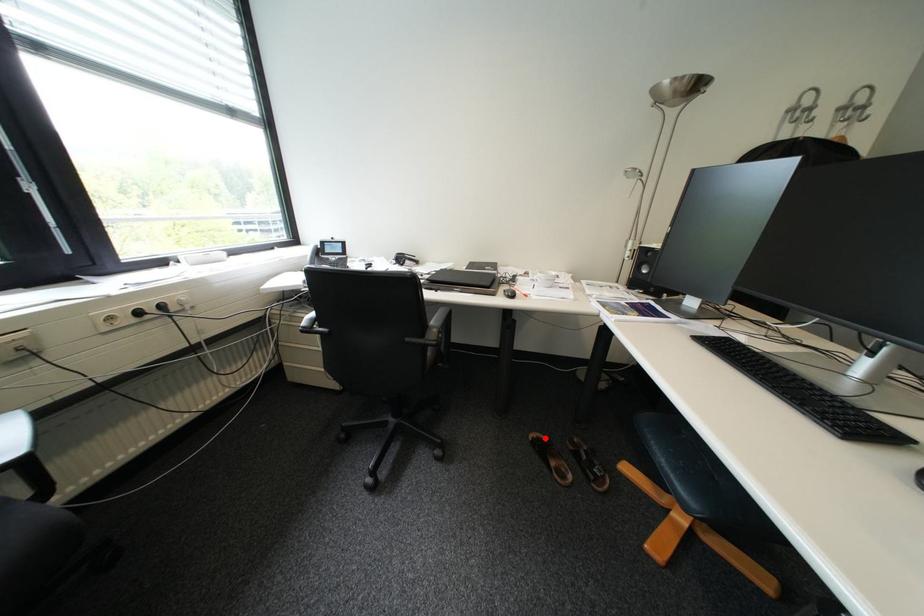
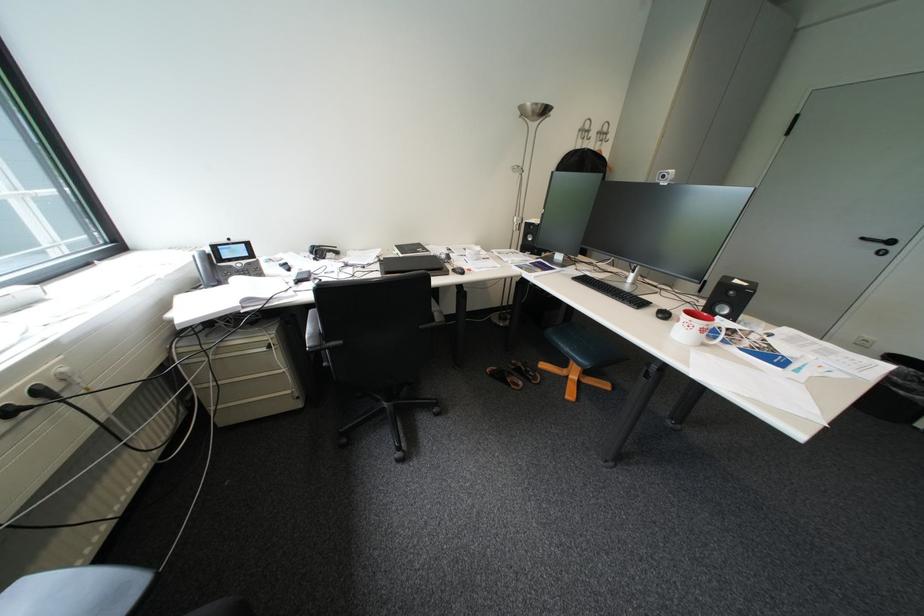
Question: I am providing you with two images of the same scene from different viewpoints. A red point is shown in image1. For the corresponding object point in image2, is it positioned nearer or farther from the camera?

Choices:
 (A) Nearer
 (B) Farther

Answer: (B)